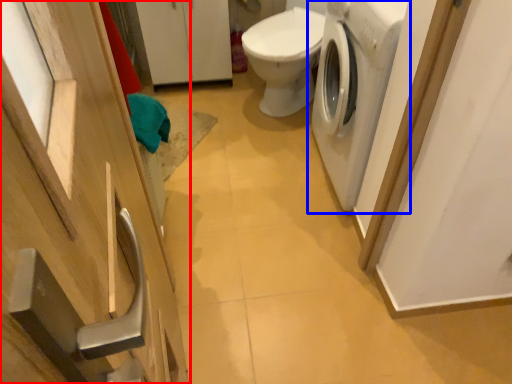
Question: Which object is closer to the camera taking this photo, cabinetry (highlighted by a red box) or washing machine (highlighted by a blue box)?

Choices:
 (A) cabinetry
 (B) washing machine

Answer: (A)